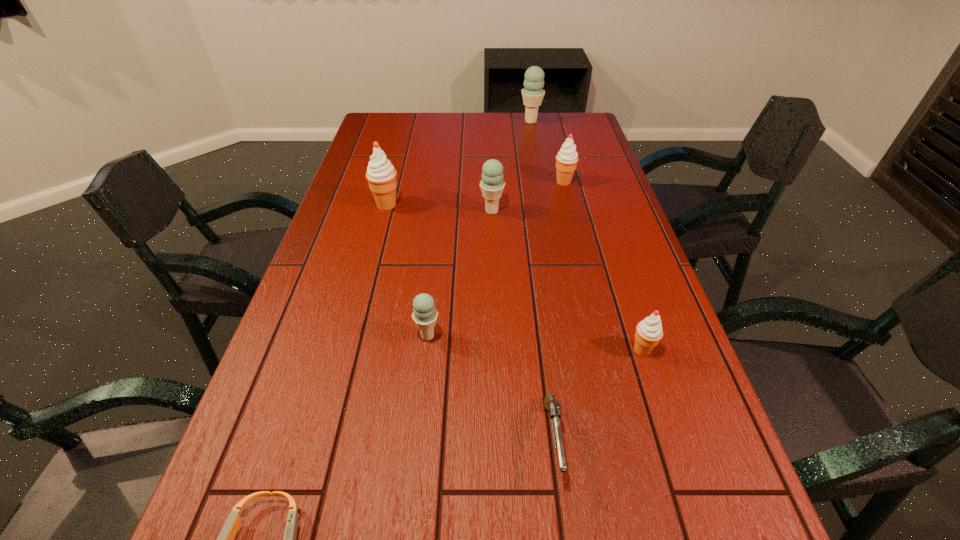
The height and width of the screenshot is (540, 960). I want to click on the nearest blue ice cream, so click(424, 314).

Where is `the smallest blue ice cream`? the smallest blue ice cream is located at coordinates (424, 314).

This screenshot has width=960, height=540. In order to click on gun in this screenshot , I will do `click(551, 405)`.

This screenshot has width=960, height=540. In order to click on the second shortest object in this screenshot , I will do `click(551, 405)`.

Identify the location of vacant space situated on the right of the rightmost blue ice cream. [x=589, y=122].

Locate an element on the screen. free space located 0.280m on the back of the leftmost red icecream is located at coordinates (400, 153).

Identify the location of free space located 0.370m on the front of the fifth nearest ice cream. (585, 266).

The width and height of the screenshot is (960, 540). What are the coordinates of `free space located on the front of the second nearest blue ice cream` in the screenshot? It's located at [494, 278].

The width and height of the screenshot is (960, 540). What are the coordinates of `vacant region located 0.280m on the front of the nearest red icecream` in the screenshot? It's located at (690, 499).

Find the location of `vacant space located on the right of the nearest blue ice cream`. vacant space located on the right of the nearest blue ice cream is located at coordinates (602, 336).